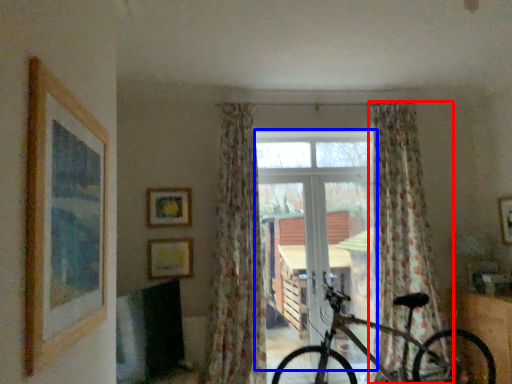
Question: Which point is further to the camera, curtain (highlighted by a red box) or window frame (highlighted by a blue box)?

Choices:
 (A) curtain
 (B) window frame

Answer: (B)